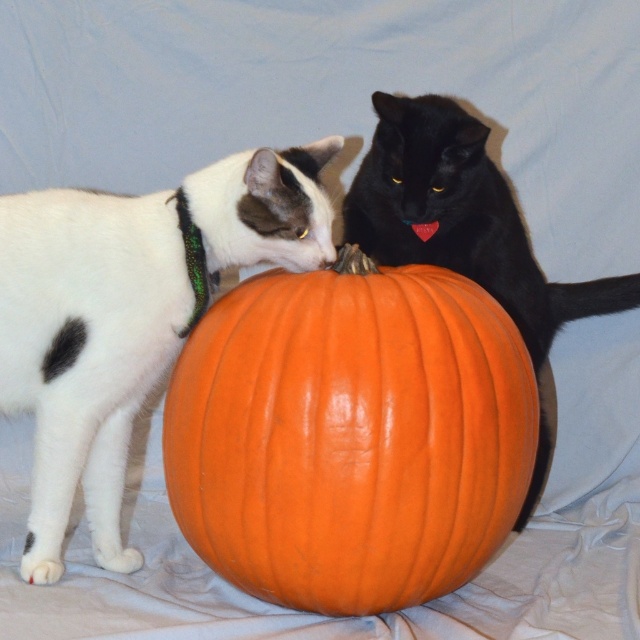
Is point (61, 304) positioned in front of point (557, 314)?

Yes, point (61, 304) is in front of point (557, 314).

Who is lower down, white matte fur cat at left or black glossy cat at center?

Positioned lower is white matte fur cat at left.

Locate an element on the screen. The image size is (640, 640). white matte fur cat at left is located at coordinates (129, 314).

Between orange matte pumpkin at center and white matte fur cat at left, which one is positioned lower?

orange matte pumpkin at center is lower down.

Who is more distant from viewer, (355, 513) or (232, 163)?

The point (232, 163) is more distant.

Where is `orange matte pumpkin at center`? orange matte pumpkin at center is located at coordinates (349, 435).

Measure the distance between orange matte pumpkin at center and black glossy cat at center.

orange matte pumpkin at center is 33.30 centimeters away from black glossy cat at center.

Does orange matte pumpkin at center have a greater height compared to black glossy cat at center?

In fact, orange matte pumpkin at center may be shorter than black glossy cat at center.

Does point (522, 500) lie behind point (556, 332)?

No, (522, 500) is in front of (556, 332).

Find the location of `orange matte pumpkin at center`. orange matte pumpkin at center is located at coordinates (349, 435).